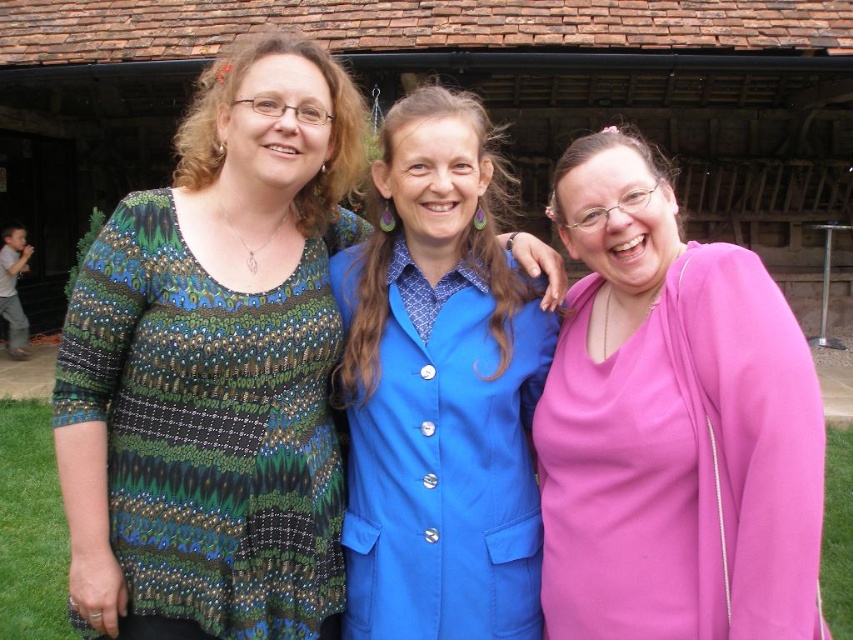
Question: Can you confirm if multicolored textured blouse at center is positioned to the right of pink satin dress at center?

Choices:
 (A) yes
 (B) no

Answer: (B)

Question: Which point is farther from the camera taking this photo?

Choices:
 (A) (439, 250)
 (B) (664, 618)
 (C) (76, 596)

Answer: (A)

Question: In this image, where is multicolored textured blouse at center located relative to pink satin dress at center?

Choices:
 (A) above
 (B) below

Answer: (A)

Question: Which of the following is the farthest from the observer?

Choices:
 (A) (682, 435)
 (B) (508, 580)
 (C) (131, 246)

Answer: (B)

Question: Does pink satin dress at center appear on the right side of blue satin blazer at center?

Choices:
 (A) no
 (B) yes

Answer: (B)

Question: Which point is farther from the camera taking this photo?

Choices:
 (A) (421, 532)
 (B) (339, 116)
 (C) (616, 241)

Answer: (B)